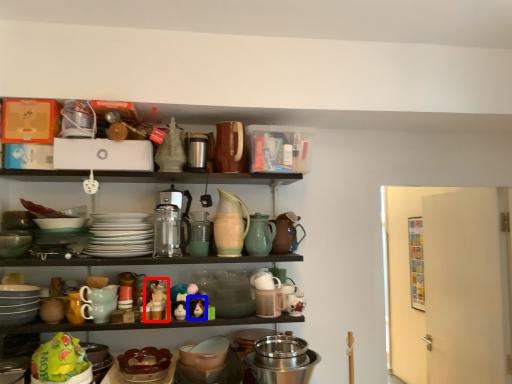
Question: Which object appears farthest to the camera in this image, toy (highlighted by a red box) or toy (highlighted by a blue box)?

Choices:
 (A) toy
 (B) toy

Answer: (A)